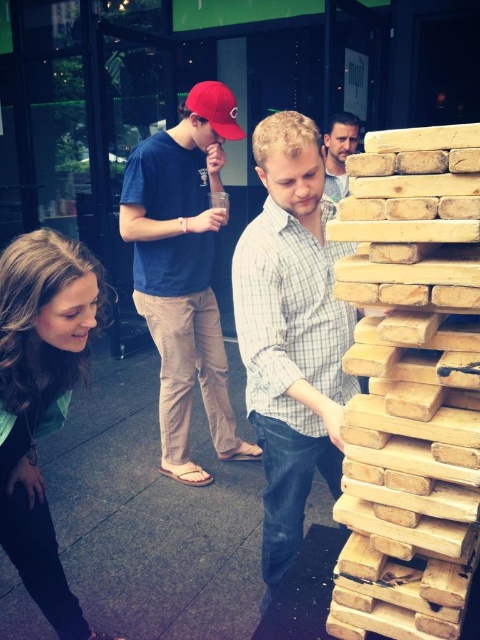
Question: In this image, where is matte blue shirt at center located relative to green matte shirt at lower left?

Choices:
 (A) left
 (B) right

Answer: (B)

Question: Is natural light wood at center bigger than checkered shirt at center?

Choices:
 (A) no
 (B) yes

Answer: (A)

Question: Considering the real-world distances, which object is closest to the matte blue shirt at center?

Choices:
 (A) smooth light blue shirt at upper center
 (B) natural light wood at center

Answer: (A)

Question: Which of these objects is positioned closest to the natural light wood at center?

Choices:
 (A) red matte baseball cap at upper left
 (B) green matte shirt at lower left
 (C) smooth light blue shirt at upper center

Answer: (B)

Question: Estimate the real-world distances between objects in this image. Which object is farther from the red matte baseball cap at upper left?

Choices:
 (A) matte blue shirt at center
 (B) green matte shirt at lower left
 (C) natural light wood at center
 (D) smooth light blue shirt at upper center

Answer: (C)

Question: Does green matte shirt at lower left appear over smooth light blue shirt at upper center?

Choices:
 (A) no
 (B) yes

Answer: (A)